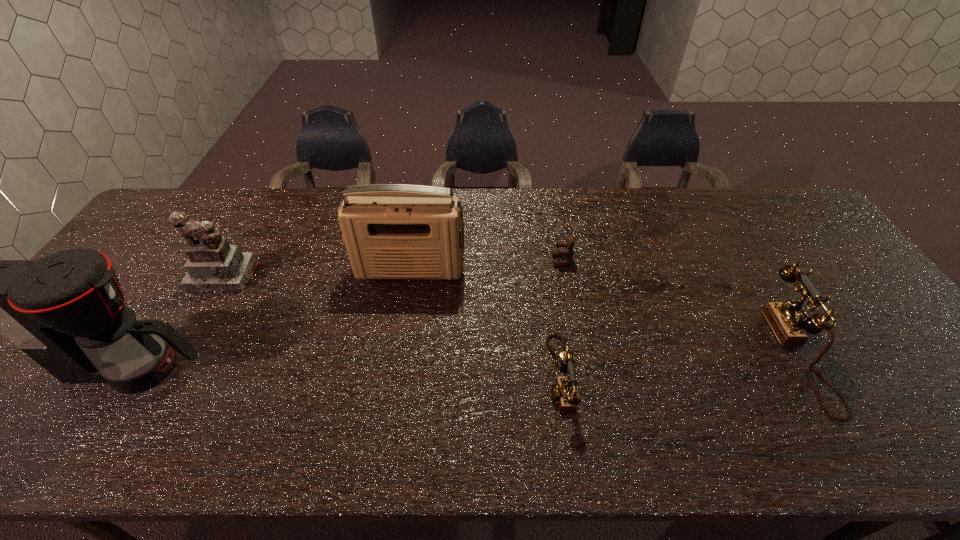
This screenshot has width=960, height=540. I want to click on the shorter telephone, so click(x=563, y=389).

The height and width of the screenshot is (540, 960). What are the coordinates of `the third object from right to left` in the screenshot? It's located at (563, 389).

At what (x,y) coordinates should I click in order to perform the action: click on the right telephone. Please return your answer as a coordinate pair (x, y). Image resolution: width=960 pixels, height=540 pixels. Looking at the image, I should click on (788, 323).

Locate an element on the screen. Image resolution: width=960 pixels, height=540 pixels. the third shortest object is located at coordinates (788, 323).

Find the location of `the third tallest object`. the third tallest object is located at coordinates (213, 265).

This screenshot has width=960, height=540. What are the coordinates of `the shortest object` in the screenshot? It's located at (567, 253).

Where is `the fifth object from left to right`? The width and height of the screenshot is (960, 540). the fifth object from left to right is located at coordinates (567, 253).

This screenshot has height=540, width=960. I want to click on coffee maker, so click(x=66, y=311).

This screenshot has width=960, height=540. I want to click on radio receiver, so click(x=391, y=231).

Where is `free point located 0.270m on the front-facing side of the shorter telephone`? The height and width of the screenshot is (540, 960). free point located 0.270m on the front-facing side of the shorter telephone is located at coordinates (435, 376).